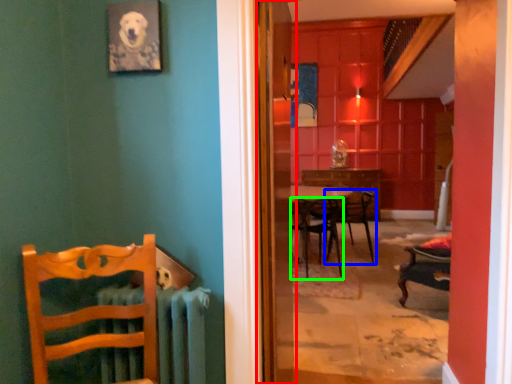
Question: Which object is the closest to the screen door (highlighted by a red box)? Choose among these: chair (highlighted by a blue box) or chair (highlighted by a green box).

Choices:
 (A) chair
 (B) chair

Answer: (B)